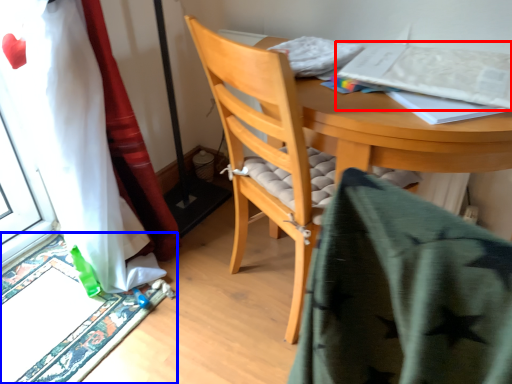
Question: Which point is closer to the camera, paperback book (highlighted by a red box) or doormat (highlighted by a blue box)?

Choices:
 (A) paperback book
 (B) doormat

Answer: (A)